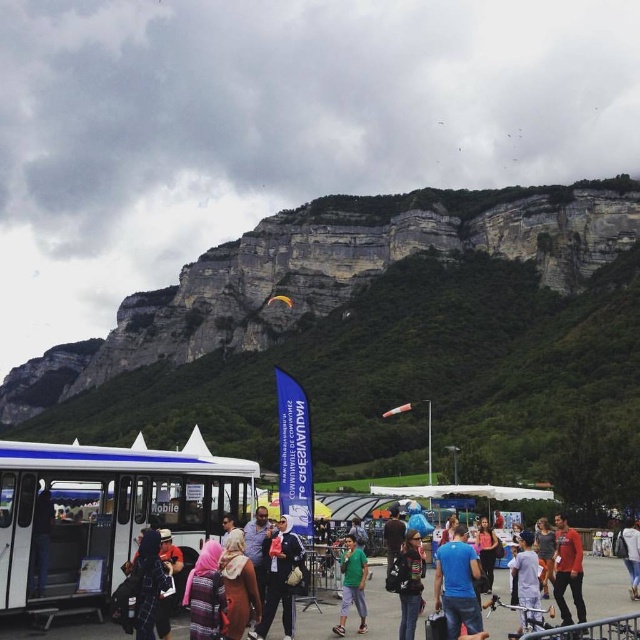
You are a photographer trying to capture both the red matte jacket at center and the matte pink shirt at center in the same frame. Since both are at the center, which one should you adjust your camera angle to focus on to ensure both are visible?

The red matte jacket at center is to the right of the matte pink shirt at center, so you should position your camera to focus slightly to the right to include both in the frame.

You are a photographer trying to capture a candid shot of both the black leather jacket at center and the matte pink shirt at center. Which clothing item will be more visible in your photo?

The black leather jacket at center is in front of the matte pink shirt at center, so it will be more visible in the photo.

You are a photographer trying to capture both the black leather jacket at center and the matte pink shirt at center in a single frame. Which clothing item should you adjust your focus on first to ensure both are in the same focal plane?

The black leather jacket at center is shorter than the matte pink shirt at center, so you should focus on the matte pink shirt at center first to ensure both are in the same focal plane.